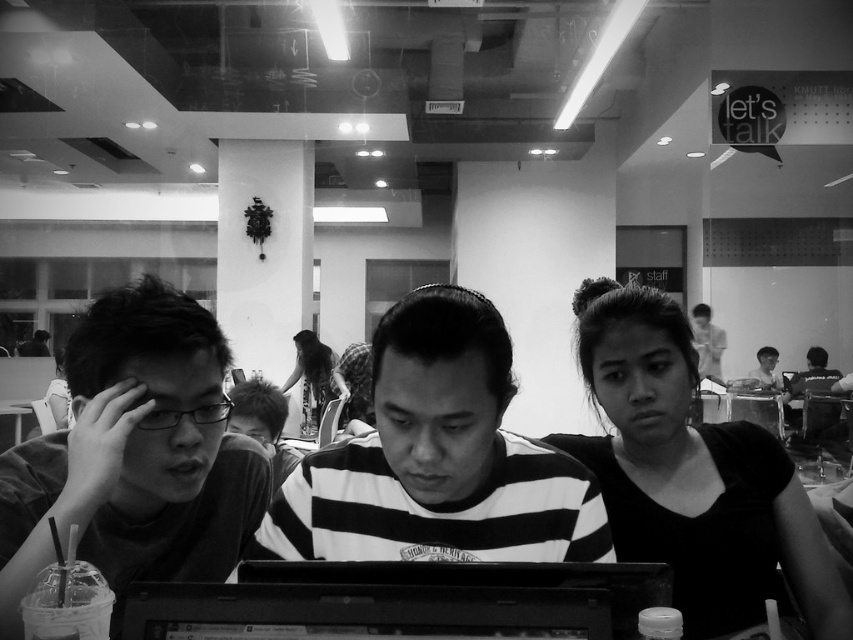
You are a photographer trying to capture a group photo of the smooth black shirt at center and the smooth skin man at upper right. Since you want to ensure both subjects are clearly visible, which subject should you position closer to the camera to avoid blurring due to their size difference?

The smooth black shirt at center has a lesser width compared to smooth skin man at upper right, so you should position the smooth black shirt at center closer to the camera to ensure both appear similarly sized and avoid blurring.

You are a photographer adjusting the camera focus. You need to ensure that both the smooth black shirt at center and the smooth skin man at upper right are in focus. Which object should you focus on first to accommodate their sizes?

The smooth black shirt at center is shorter than the smooth skin man at upper right, so you should focus on the smooth skin man at upper right first to ensure proper depth of field for both.

You are a photographer trying to capture a group photo of the smooth black shirt at center and the smooth skin man at upper right. Since you want both subjects to appear equally sized in the photo, which subject should you move closer to the camera?

The smooth black shirt at center should be moved closer to the camera because it is smaller than the smooth skin man at upper right, so moving it closer will make it appear larger in the photo and balance their sizes.